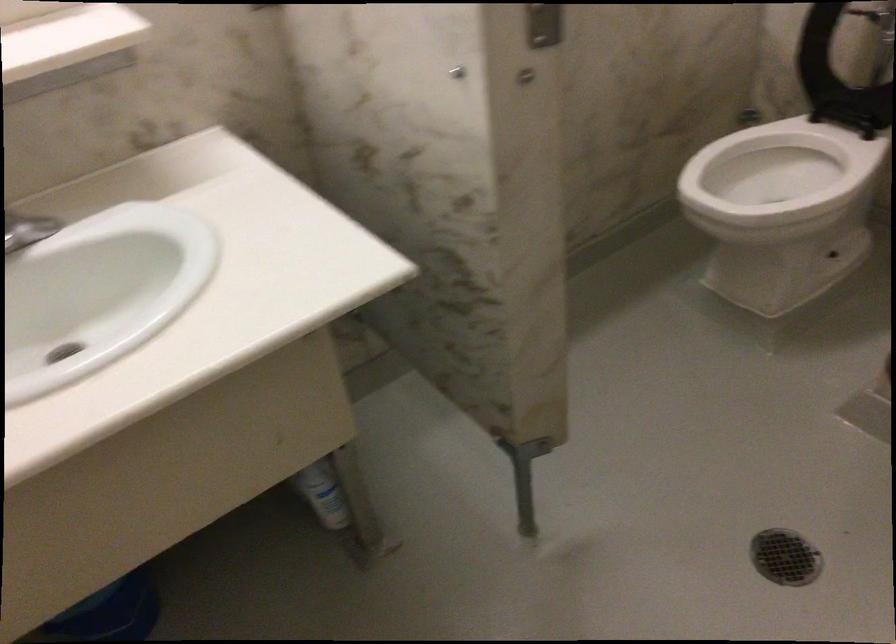
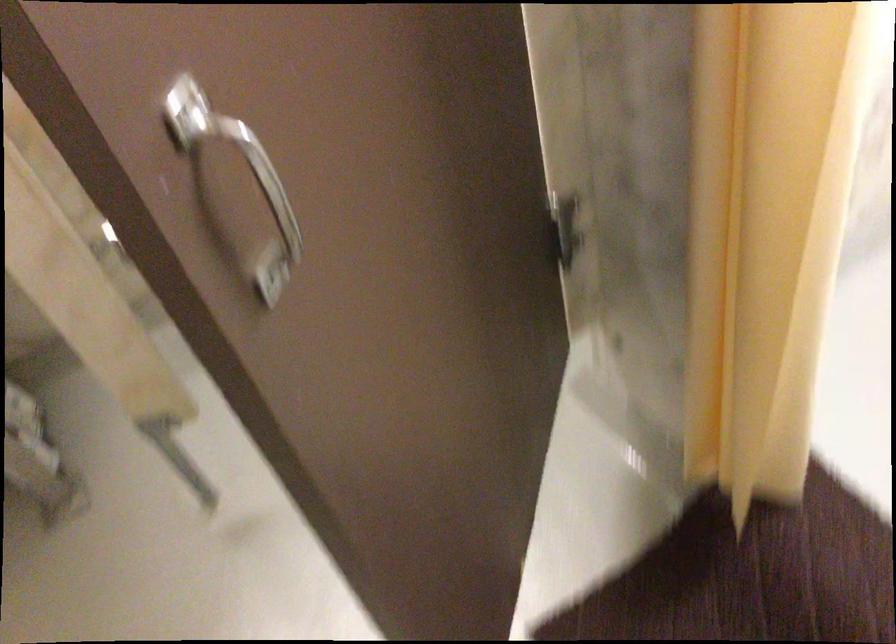
Question: What movement of the cameraman would produce the second image?

Choices:
 (A) Left
 (B) Right
 (C) Forward
 (D) Backward

Answer: (B)